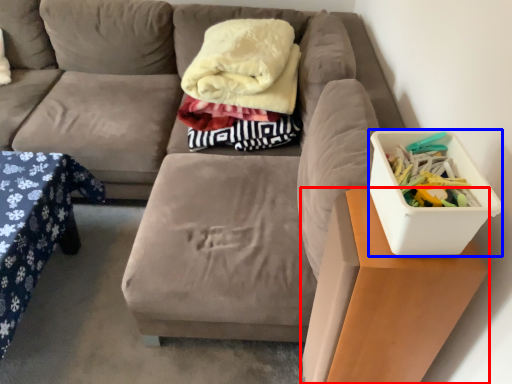
Question: Which object appears farthest to the camera in this image, table (highlighted by a red box) or storage box (highlighted by a blue box)?

Choices:
 (A) table
 (B) storage box

Answer: (A)